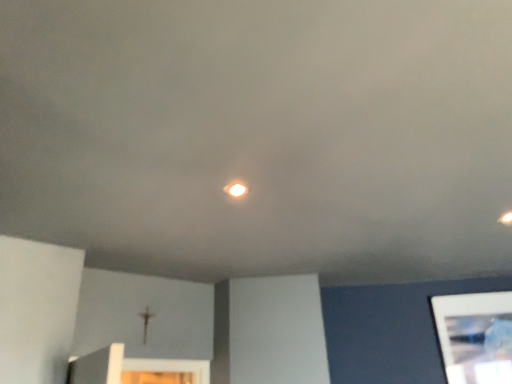
Question: Is point (245, 190) positioned closer to the camera than point (480, 375)?

Choices:
 (A) closer
 (B) farther

Answer: (A)

Question: Is matte white light at center in front of or behind white glossy tablet at lower right in the image?

Choices:
 (A) front
 (B) behind

Answer: (A)

Question: Considering the positions of matte white light at center and white glossy tablet at lower right in the image, is matte white light at center taller or shorter than white glossy tablet at lower right?

Choices:
 (A) tall
 (B) short

Answer: (B)

Question: Considering the positions of white glossy tablet at lower right and matte white light at center in the image, is white glossy tablet at lower right taller or shorter than matte white light at center?

Choices:
 (A) short
 (B) tall

Answer: (B)

Question: From a real-world perspective, is white glossy tablet at lower right above or below matte white light at center?

Choices:
 (A) below
 (B) above

Answer: (A)

Question: In terms of width, does white glossy tablet at lower right look wider or thinner when compared to matte white light at center?

Choices:
 (A) thin
 (B) wide

Answer: (A)

Question: Is point (456, 344) positioned closer to the camera than point (236, 190)?

Choices:
 (A) farther
 (B) closer

Answer: (A)